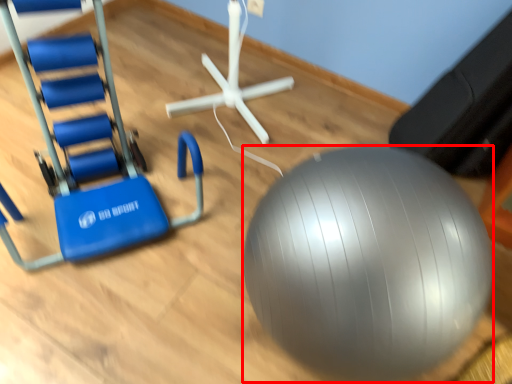
Question: From the image, what is the correct spatial relationship of ball (annotated by the red box) in relation to swivel chair?

Choices:
 (A) left
 (B) right

Answer: (B)